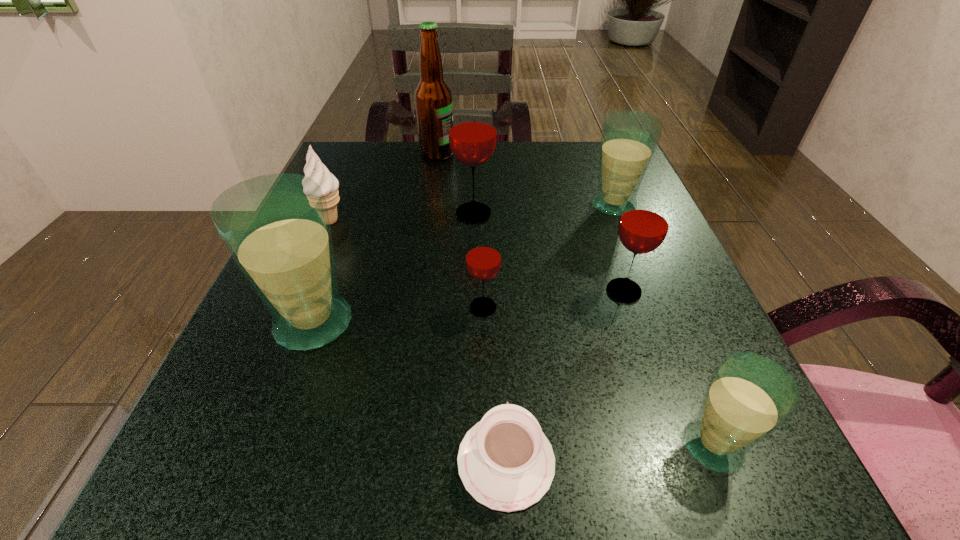
Where is `the tallest object`? the tallest object is located at coordinates (433, 97).

The height and width of the screenshot is (540, 960). Identify the location of the farthest object. (433, 97).

Image resolution: width=960 pixels, height=540 pixels. Find the location of `the farthest red glass`. the farthest red glass is located at coordinates (472, 130).

Locate an element on the screen. Image resolution: width=960 pixels, height=540 pixels. the leftmost glass is located at coordinates pyautogui.click(x=276, y=227).

The height and width of the screenshot is (540, 960). Find the location of `the leftmost blue glass`. the leftmost blue glass is located at coordinates (276, 227).

This screenshot has width=960, height=540. I want to click on the second smallest red glass, so click(x=644, y=223).

Image resolution: width=960 pixels, height=540 pixels. I want to click on the farthest blue glass, so click(x=629, y=139).

Identify the location of icecream. This screenshot has height=540, width=960. (314, 168).

You are a GUI agent. You are given a task and a screenshot of the screen. Output one action in this format:
    pyautogui.click(x=<x>, y=<y>)
    Task: Click on the smallest red glass
    The height and width of the screenshot is (540, 960).
    Given the screenshot: What is the action you would take?
    pyautogui.click(x=483, y=260)

Where is `the nearest blue glass`? the nearest blue glass is located at coordinates (749, 396).